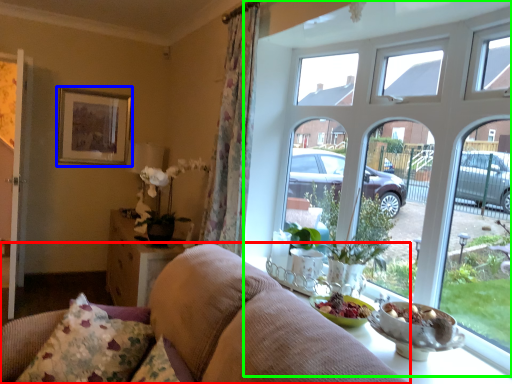
Question: Considering the real-world distances, which object is farthest from studio couch (highlighted by a red box)? picture frame (highlighted by a blue box) or window (highlighted by a green box)?

Choices:
 (A) picture frame
 (B) window

Answer: (A)